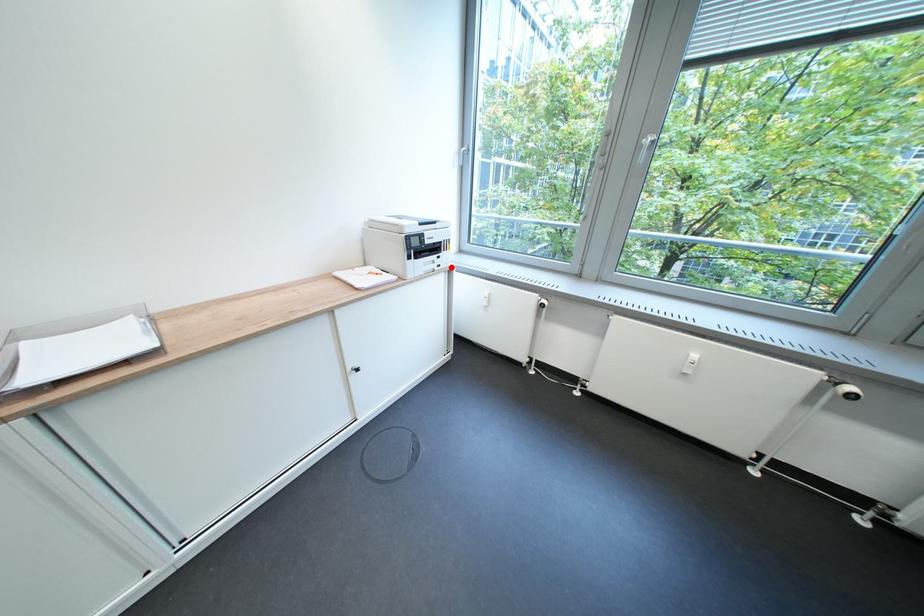
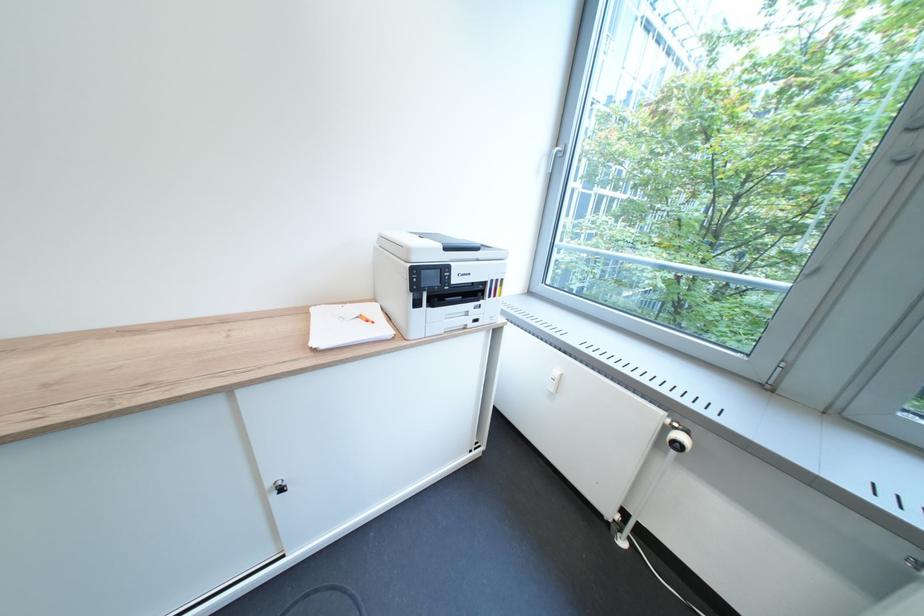
Locate, in the second image, the point that corresponds to the highlighted location in the first image.

(489, 322)